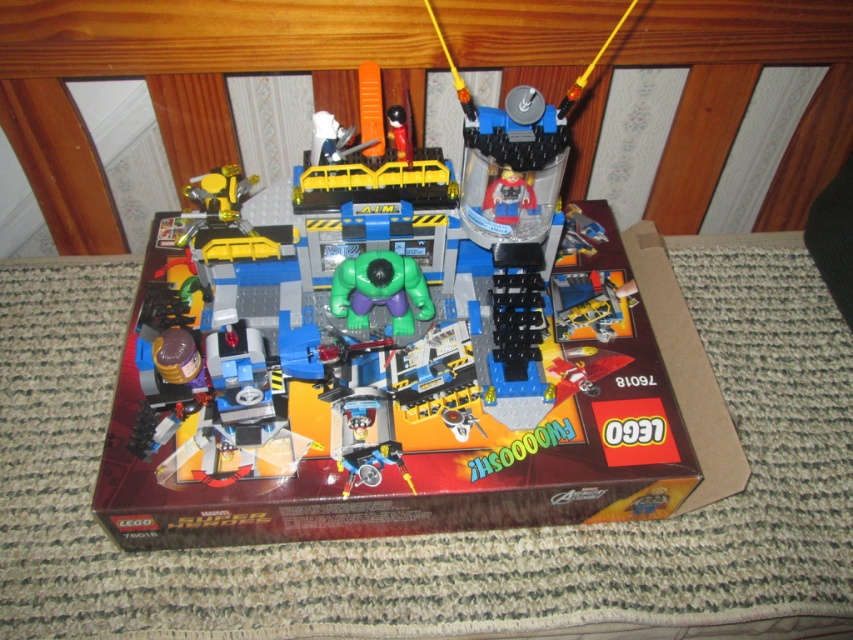
You are a parent trying to pack away the LEGO set. You have a brown cardboard box at center and a green rubber toy at center. Which item should you place first into the storage bin if you want to maximize space efficiency?

The brown cardboard box at center is larger in size than the green rubber toy at center, so you should place the green rubber toy at center first to fit it into any remaining spaces afterward.